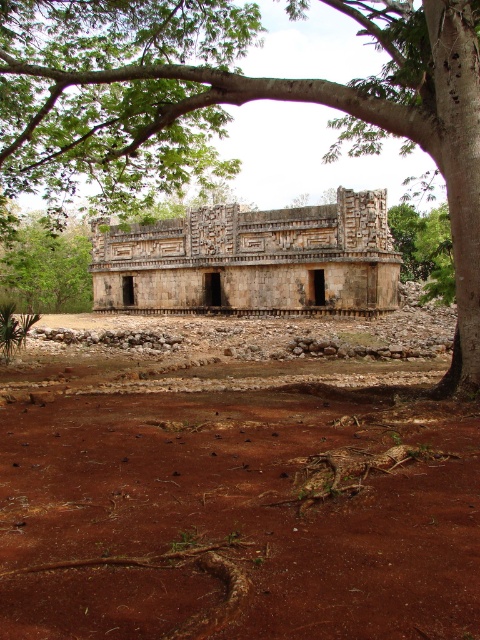
You are an archaeologist examining the ancient stone structure. You notice the brown soil at center and the stone textured temple at center. Which of these two features occupies a larger area in the scene?

The stone textured temple at center is larger than the brown soil at center.

You are an archaeologist standing in front of the stone textured temple at center. You notice a green leafy tree at upper left in the distance. Which object is nearer to you?

The stone textured temple at center is closer to the viewer than the green leafy tree at upper left.

You are an archaeologist examining the ancient stone structure. You notice the brown soil at center and the green leafy tree at upper left. Which object is closer to the structure?

The brown soil at center is in front of the green leafy tree at upper left, so the brown soil at center is closer to the structure.